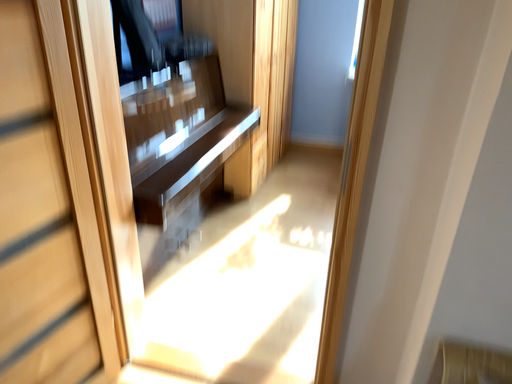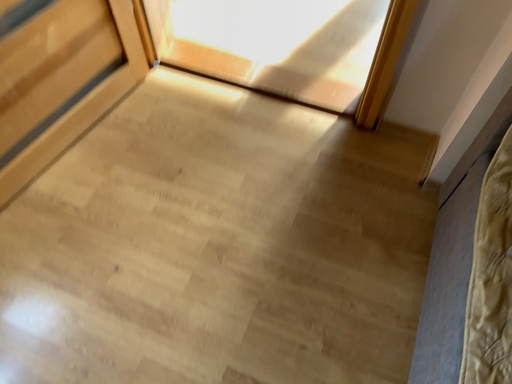
Question: How did the camera likely rotate when shooting the video?

Choices:
 (A) rotated downward
 (B) rotated upward

Answer: (A)